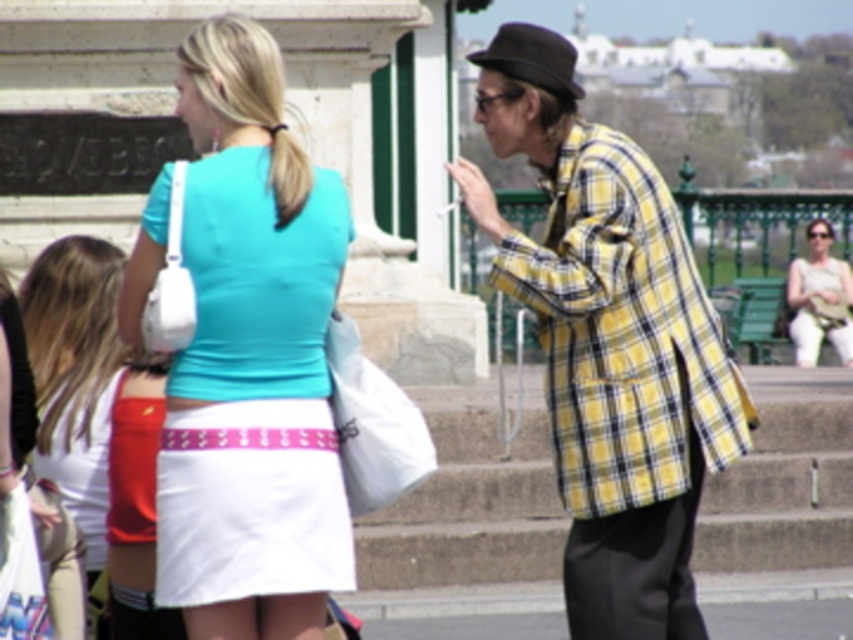
This screenshot has width=853, height=640. What do you see at coordinates (252, 358) in the screenshot?
I see `matte teal blouse at center` at bounding box center [252, 358].

What are the coordinates of `matte teal blouse at center` in the screenshot? It's located at (252, 358).

Is yellow plaid jacket at center smaller than white fabric purse at right?

No.

The image size is (853, 640). Describe the element at coordinates (613, 358) in the screenshot. I see `yellow plaid jacket at center` at that location.

Image resolution: width=853 pixels, height=640 pixels. Find the location of `yellow plaid jacket at center`. yellow plaid jacket at center is located at coordinates (613, 358).

Is white cotton skirt at lower left wider than black felt fedora at upper right?

Incorrect, white cotton skirt at lower left's width does not surpass black felt fedora at upper right's.

Describe the element at coordinates (74, 376) in the screenshot. This screenshot has height=640, width=853. I see `white cotton skirt at lower left` at that location.

Does point (103, 420) come closer to viewer compared to point (520, 44)?

Yes, it is.

I want to click on white cotton skirt at lower left, so click(x=74, y=376).